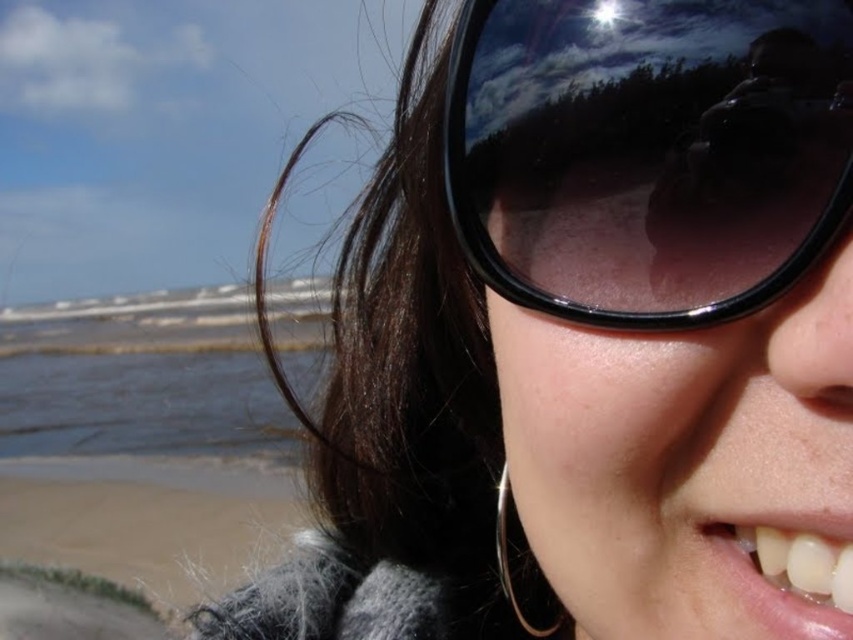
Which is below, black plastic sunglasses at upper center or sandy beach at lower left?

sandy beach at lower left

Locate an element on the screen. The image size is (853, 640). black plastic sunglasses at upper center is located at coordinates (648, 150).

This screenshot has width=853, height=640. Identify the location of black plastic sunglasses at upper center. click(x=648, y=150).